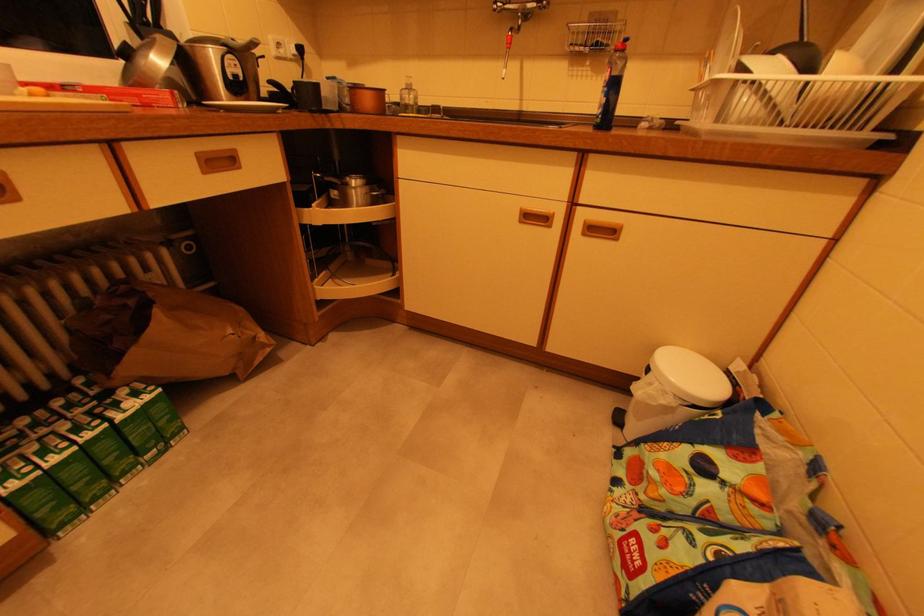
You are a GUI agent. You are given a task and a screenshot of the screen. Output one action in this format:
    pyautogui.click(x=<x>, y=<y>)
    Task: Click on the black pan handle
    The width and height of the screenshot is (924, 616).
    Given the screenshot: What is the action you would take?
    pyautogui.click(x=355, y=176)